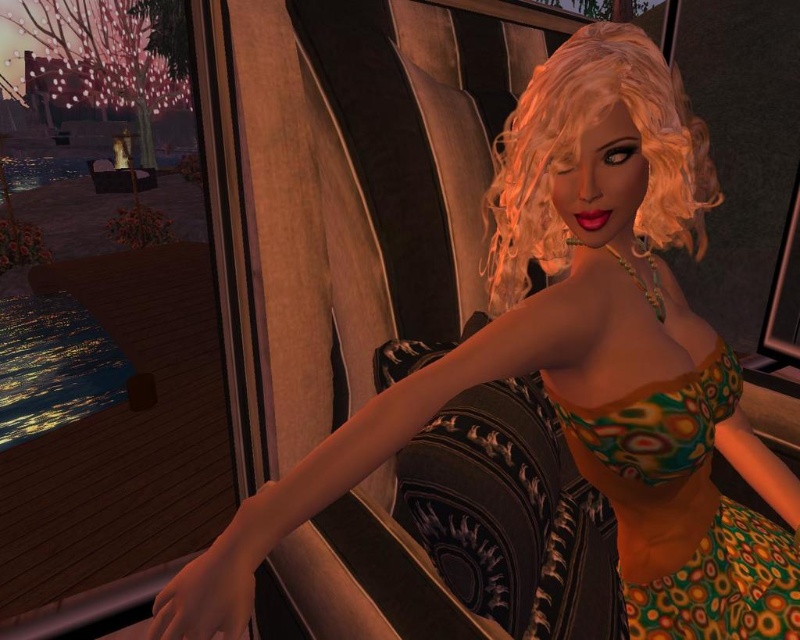
Is point (708, 570) positioned in front of point (686, 417)?

No, it is not.

Can you confirm if multicolored printed dress at center is taller than multicolored printed bikini top at center?

Incorrect, multicolored printed dress at center's height is not larger of multicolored printed bikini top at center's.

Is point (734, 556) positioned after point (730, 392)?

That is True.

Identify the location of multicolored printed dress at center. (724, 584).

Does blonde curly wig at upper right have a greater width compared to multicolored printed dress at center?

Correct, the width of blonde curly wig at upper right exceeds that of multicolored printed dress at center.

Which is more to the left, blonde curly wig at upper right or multicolored printed dress at center?

Positioned to the left is multicolored printed dress at center.

Where is `blonde curly wig at upper right`? blonde curly wig at upper right is located at coordinates (578, 154).

From the picture: Which is above, blonde curly wig at upper right or multicolored printed bikini top at center?

Positioned higher is blonde curly wig at upper right.

Who is shorter, blonde curly wig at upper right or multicolored printed bikini top at center?

Standing shorter between the two is multicolored printed bikini top at center.

The width and height of the screenshot is (800, 640). What do you see at coordinates (578, 154) in the screenshot?
I see `blonde curly wig at upper right` at bounding box center [578, 154].

Locate an element on the screen. The height and width of the screenshot is (640, 800). blonde curly wig at upper right is located at coordinates (578, 154).